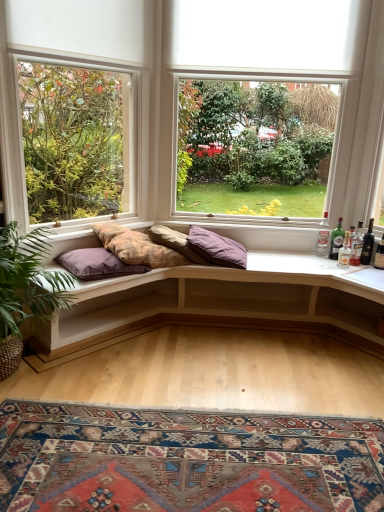
What do you see at coordinates (356, 246) in the screenshot? This screenshot has width=384, height=512. I see `clear glass bottle at right, acting as the 4th bottle starting from the left` at bounding box center [356, 246].

What is the approximate width of purple soft cushion at left, arranged as the 3th pillow when viewed from the right?

17.61 inches.

The height and width of the screenshot is (512, 384). What do you see at coordinates (323, 236) in the screenshot? I see `clear glass bottle at right, marked as the fifth bottle in a right-to-left arrangement` at bounding box center [323, 236].

Measure the distance between point (x=37, y=420) and camera.

Point (x=37, y=420) is 6.48 feet away from camera.

Find the location of `matte white window at center, the second window positioned from the right`. matte white window at center, the second window positioned from the right is located at coordinates tap(75, 141).

From the image's perspective, between purple soft cushion at center, placed as the third pillow when sorted from left to right, and green glass bottle at right, which is the fourth bottle in right-to-left order, who is located below?

green glass bottle at right, which is the fourth bottle in right-to-left order, from the image's perspective.

Are purple soft cushion at center, placed as the third pillow when sorted from left to right, and green glass bottle at right, which is the fourth bottle in right-to-left order, located far from each other?

That's not correct — purple soft cushion at center, placed as the third pillow when sorted from left to right, is a little close to green glass bottle at right, which is the fourth bottle in right-to-left order.

What's the angular difference between purple soft cushion at center, which is the 1th pillow in right-to-left order, and green glass bottle at right, acting as the second bottle starting from the left,'s facing directions?

40.9 degrees separate the facing orientations of purple soft cushion at center, which is the 1th pillow in right-to-left order, and green glass bottle at right, acting as the second bottle starting from the left.

Looking at this image, can you confirm if purple soft cushion at center, placed as the third pillow when sorted from left to right, is wider than green glass bottle at right, which is the fourth bottle in right-to-left order?

Yes.

Is translucent glass bottle at right, which is counted as the 5th bottle, starting from the left, taller than purple soft cushion at center, which is the 1th pillow in right-to-left order?

No, translucent glass bottle at right, which is counted as the 5th bottle, starting from the left, is not taller than purple soft cushion at center, which is the 1th pillow in right-to-left order.

Considering the sizes of objects translucent glass bottle at right, which is counted as the 5th bottle, starting from the left, and purple soft cushion at center, placed as the third pillow when sorted from left to right, in the image provided, who is smaller, translucent glass bottle at right, which is counted as the 5th bottle, starting from the left, or purple soft cushion at center, placed as the third pillow when sorted from left to right,?

With smaller size is translucent glass bottle at right, which is counted as the 5th bottle, starting from the left.

Is translucent glass bottle at right, which is the 1th bottle from right to left, to the left of purple soft cushion at center, placed as the third pillow when sorted from left to right, from the viewer's perspective?

No.

What's the angular difference between translucent glass bottle at right, which is counted as the 5th bottle, starting from the left, and purple soft cushion at center, placed as the third pillow when sorted from left to right,'s facing directions?

42.8 degrees.

Which is correct: clear glass bottle at right, positioned as the second bottle in right-to-left order, is inside textured fabric pillow at center, which ranks as the 2th pillow in right-to-left order, or outside of it?

The correct answer is: outside.

Is clear glass bottle at right, positioned as the second bottle in right-to-left order, oriented towards textured fabric pillow at center, positioned as the 2th pillow in left-to-right order?

No.

From the image's perspective, is clear glass bottle at right, acting as the 4th bottle starting from the left, on textured fabric pillow at center, which ranks as the 2th pillow in right-to-left order?

Actually, clear glass bottle at right, acting as the 4th bottle starting from the left, appears below textured fabric pillow at center, which ranks as the 2th pillow in right-to-left order, in the image.

Considering the sizes of objects textured cotton cushions at center and textured fabric pillow at center, positioned as the 2th pillow in left-to-right order, in the image provided, who is shorter, textured cotton cushions at center or textured fabric pillow at center, positioned as the 2th pillow in left-to-right order,?

Standing shorter between the two is textured fabric pillow at center, positioned as the 2th pillow in left-to-right order.

Between textured cotton cushions at center and textured fabric pillow at center, which ranks as the 2th pillow in right-to-left order, which one has smaller size?

Smaller between the two is textured fabric pillow at center, which ranks as the 2th pillow in right-to-left order.

Is textured cotton cushions at center spatially inside textured fabric pillow at center, which ranks as the 2th pillow in right-to-left order, or outside of it?

textured cotton cushions at center is spatially situated outside textured fabric pillow at center, which ranks as the 2th pillow in right-to-left order.

From the image's perspective, is textured cotton cushions at center located above or below textured fabric pillow at center, positioned as the 2th pillow in left-to-right order?

Based on their image positions, textured cotton cushions at center is located beneath textured fabric pillow at center, positioned as the 2th pillow in left-to-right order.

Considering the relative sizes of green leafy plant at left and carpeted rug at lower center in the image provided, is green leafy plant at left taller than carpeted rug at lower center?

Correct, green leafy plant at left is much taller as carpeted rug at lower center.

Does green leafy plant at left have a greater width compared to carpeted rug at lower center?

No, green leafy plant at left is not wider than carpeted rug at lower center.

I want to click on mat that is in front of the green leafy plant at left, so click(185, 460).

Are green leafy plant at left and carpeted rug at lower center located far from each other?

No, green leafy plant at left is not far from carpeted rug at lower center.

Which of these two, clear glass bottle at right, acting as the 4th bottle starting from the left, or green glass bottle at right, the third bottle viewed from the right, is wider?

clear glass bottle at right, acting as the 4th bottle starting from the left, is wider.

Is clear glass bottle at right, acting as the 4th bottle starting from the left, bigger than green glass bottle at right, the third bottle viewed from the right?

No, clear glass bottle at right, acting as the 4th bottle starting from the left, is not bigger than green glass bottle at right, the third bottle viewed from the right.

What's the angular difference between clear glass bottle at right, positioned as the second bottle in right-to-left order, and green glass bottle at right, the third bottle viewed from the right,'s facing directions?

34.5 degrees.

Does clear glass bottle at right, positioned as the second bottle in right-to-left order, turn towards green glass bottle at right, the third bottle viewed from the right?

No, clear glass bottle at right, positioned as the second bottle in right-to-left order, is not oriented towards green glass bottle at right, the third bottle viewed from the right.

Can you confirm if clear glass bottle at right, the first bottle from the left, is taller than translucent glass bottle at right, which is counted as the 5th bottle, starting from the left?

Correct, clear glass bottle at right, the first bottle from the left, is much taller as translucent glass bottle at right, which is counted as the 5th bottle, starting from the left.

Which is closer to the camera, (321, 227) or (365, 241)?

The point (365, 241) is more forward.

From the image's perspective, is clear glass bottle at right, the first bottle from the left, beneath translucent glass bottle at right, which is the 1th bottle from right to left?

No, from the image's perspective, clear glass bottle at right, the first bottle from the left, is not beneath translucent glass bottle at right, which is the 1th bottle from right to left.

Considering the sizes of objects clear glass bottle at right, marked as the fifth bottle in a right-to-left arrangement, and translucent glass bottle at right, which is the 1th bottle from right to left, in the image provided, who is thinner, clear glass bottle at right, marked as the fifth bottle in a right-to-left arrangement, or translucent glass bottle at right, which is the 1th bottle from right to left,?

With smaller width is translucent glass bottle at right, which is the 1th bottle from right to left.

You are a GUI agent. You are given a task and a screenshot of the screen. Output one action in this format:
    pyautogui.click(x=<x>, y=<y>)
    Task: Click on the bottle that is below the purple soft cushion at center, placed as the third pillow when sorted from left to right (from the image's perspective)
    This screenshot has width=384, height=512.
    Given the screenshot: What is the action you would take?
    pyautogui.click(x=345, y=252)

The width and height of the screenshot is (384, 512). In order to click on the 2nd pillow directly beneath the translucent glass bottle at right, which is counted as the 5th bottle, starting from the left (from a real-world perspective) in this screenshot , I will do `click(217, 248)`.

Estimate the real-world distances between objects in this image. Which object is closer to carpeted rug at lower center, matte white window at center, which appears as the 1th window when viewed from the right, or textured cotton cushions at center?

Based on the image, textured cotton cushions at center appears to be nearer to carpeted rug at lower center.

When comparing their distances from purple soft cushion at center, placed as the third pillow when sorted from left to right, does clear glass bottle at right, acting as the 4th bottle starting from the left, or matte white window at center, the second window positioned from the right, seem closer?

clear glass bottle at right, acting as the 4th bottle starting from the left.

From the image, which object appears to be nearer to translucent glass bottle at right, which is the 1th bottle from right to left, green glass bottle at right, the 3th bottle viewed from the left, or purple soft cushion at left, arranged as the 3th pillow when viewed from the right?

Based on the image, green glass bottle at right, the 3th bottle viewed from the left, appears to be nearer to translucent glass bottle at right, which is the 1th bottle from right to left.

From the image, which object appears to be farther from clear glass bottle at right, positioned as the second bottle in right-to-left order, textured fabric pillow at center, positioned as the 2th pillow in left-to-right order, or clear glass bottle at right, marked as the fifth bottle in a right-to-left arrangement?

textured fabric pillow at center, positioned as the 2th pillow in left-to-right order, lies further to clear glass bottle at right, positioned as the second bottle in right-to-left order, than the other object.

Looking at the image, which one is located further to clear glass bottle at right, acting as the 4th bottle starting from the left, matte white window at center, the second window positioned from the right, or purple soft cushion at left, arranged as the 3th pillow when viewed from the right?

matte white window at center, the second window positioned from the right, is positioned further to the anchor clear glass bottle at right, acting as the 4th bottle starting from the left.

Which object lies further to the anchor point clear glass bottle at right, positioned as the second bottle in right-to-left order, carpeted rug at lower center or purple soft cushion at left, arranged as the 3th pillow when viewed from the right?

The object further to clear glass bottle at right, positioned as the second bottle in right-to-left order, is carpeted rug at lower center.

Based on their spatial positions, is green glass bottle at right, which is the fourth bottle in right-to-left order, or clear glass bottle at right, acting as the 4th bottle starting from the left, closer to translucent glass bottle at right, which is the 1th bottle from right to left?

Among the two, clear glass bottle at right, acting as the 4th bottle starting from the left, is located nearer to translucent glass bottle at right, which is the 1th bottle from right to left.

Estimate the real-world distances between objects in this image. Which object is further from green glass bottle at right, acting as the second bottle starting from the left, textured cotton cushions at center or translucent glass bottle at right, which is the 1th bottle from right to left?

textured cotton cushions at center.

Locate an element on the screen. This screenshot has height=512, width=384. bottle between textured fabric pillow at center, which ranks as the 2th pillow in right-to-left order, and green glass bottle at right, acting as the second bottle starting from the left, from left to right is located at coordinates (323, 236).

Locate an element on the screen. This screenshot has height=512, width=384. bedding located between carpeted rug at lower center and textured fabric pillow at center, positioned as the 2th pillow in left-to-right order, in the depth direction is located at coordinates (147, 252).

Identify the location of studio couch positioned between carpeted rug at lower center and green glass bottle at right, acting as the second bottle starting from the left, from near to far. (217, 304).

This screenshot has width=384, height=512. I want to click on window located between textured cotton cushions at center and translucent glass bottle at right, which is counted as the 5th bottle, starting from the left, in the left-right direction, so click(x=202, y=78).